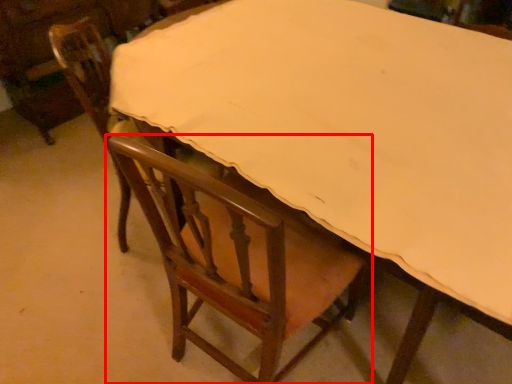
Question: In this image, where is chair (annotated by the red box) located relative to chair?

Choices:
 (A) right
 (B) left

Answer: (A)